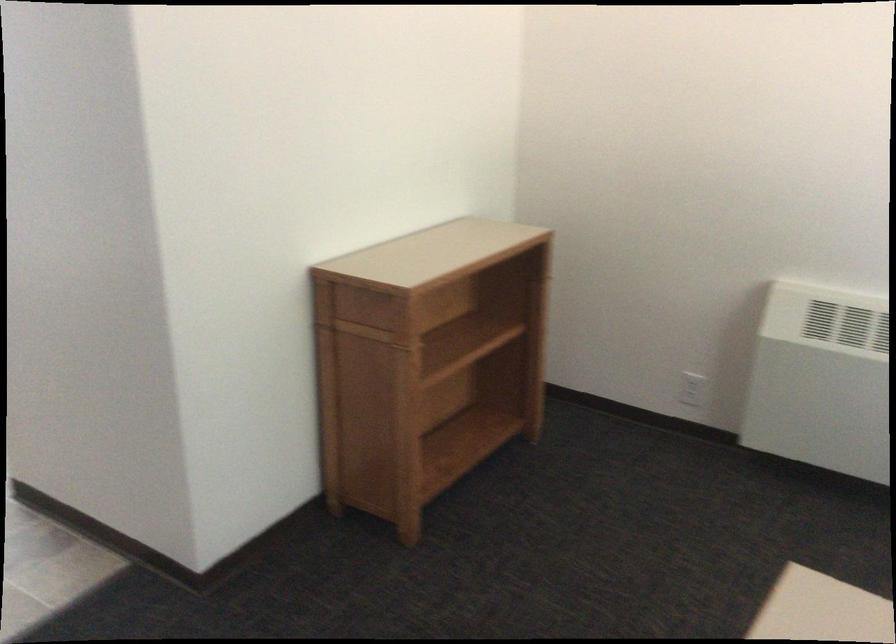
Image resolution: width=896 pixels, height=644 pixels. What do you see at coordinates (462, 345) in the screenshot?
I see `a wooden drawer front` at bounding box center [462, 345].